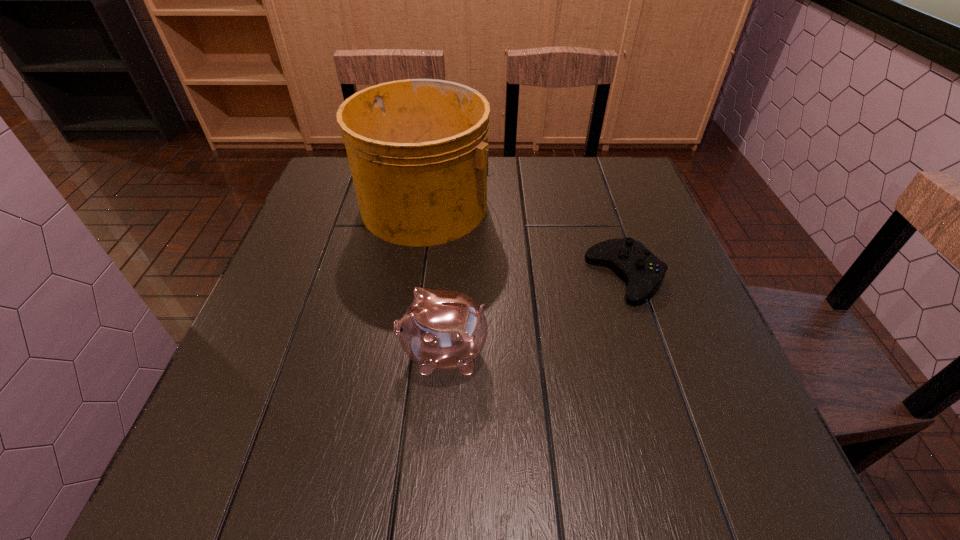
Where is `the tallest object`? The height and width of the screenshot is (540, 960). the tallest object is located at coordinates (418, 149).

Locate an element on the screen. The image size is (960, 540). the farthest object is located at coordinates (418, 149).

Identify the location of the second shortest object. (439, 330).

The image size is (960, 540). What are the coordinates of `the nearest object` in the screenshot? It's located at (439, 330).

Image resolution: width=960 pixels, height=540 pixels. In order to click on the second farthest object in this screenshot , I will do `click(640, 267)`.

Where is `the shortest object`? the shortest object is located at coordinates (640, 267).

The height and width of the screenshot is (540, 960). Identify the location of free region located 0.110m on the front of the bucket. (416, 282).

The height and width of the screenshot is (540, 960). Find the location of `vacant space located on the front facing side of the nearest object`. vacant space located on the front facing side of the nearest object is located at coordinates (238, 353).

Where is `free point located 0.110m on the front facing side of the nearest object`? This screenshot has width=960, height=540. free point located 0.110m on the front facing side of the nearest object is located at coordinates (340, 353).

This screenshot has width=960, height=540. Identify the location of vacant space situated 0.100m on the front facing side of the nearest object. (346, 353).